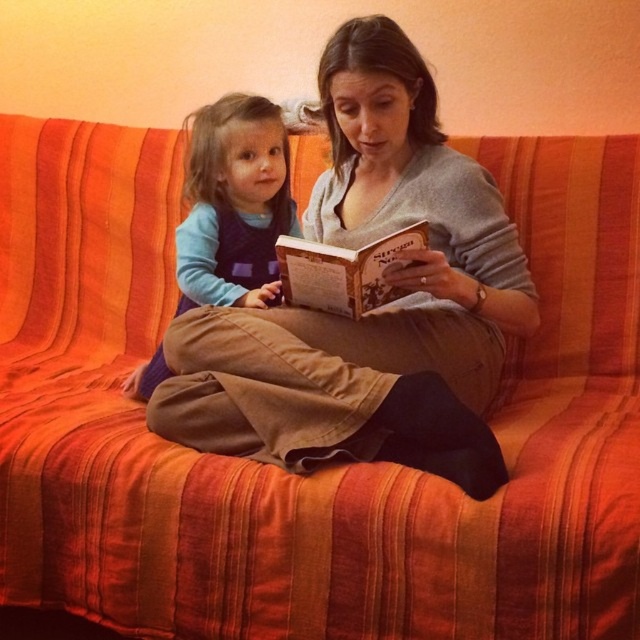
Question: Is matte gray sweater at center thinner than brown paper at center?

Choices:
 (A) yes
 (B) no

Answer: (B)

Question: Can you confirm if blue fleece top at upper left is positioned to the right of brown paper at center?

Choices:
 (A) yes
 (B) no

Answer: (B)

Question: Based on their relative distances, which object is farther from the brown paper at center?

Choices:
 (A) matte gray sweater at center
 (B) blue fleece top at upper left

Answer: (B)

Question: Which of the following is the farthest from the observer?

Choices:
 (A) matte gray sweater at center
 (B) brown paper at center

Answer: (B)

Question: Is matte gray sweater at center above blue fleece top at upper left?

Choices:
 (A) no
 (B) yes

Answer: (A)

Question: Based on their relative distances, which object is nearer to the matte gray sweater at center?

Choices:
 (A) brown paper at center
 (B) blue fleece top at upper left

Answer: (A)